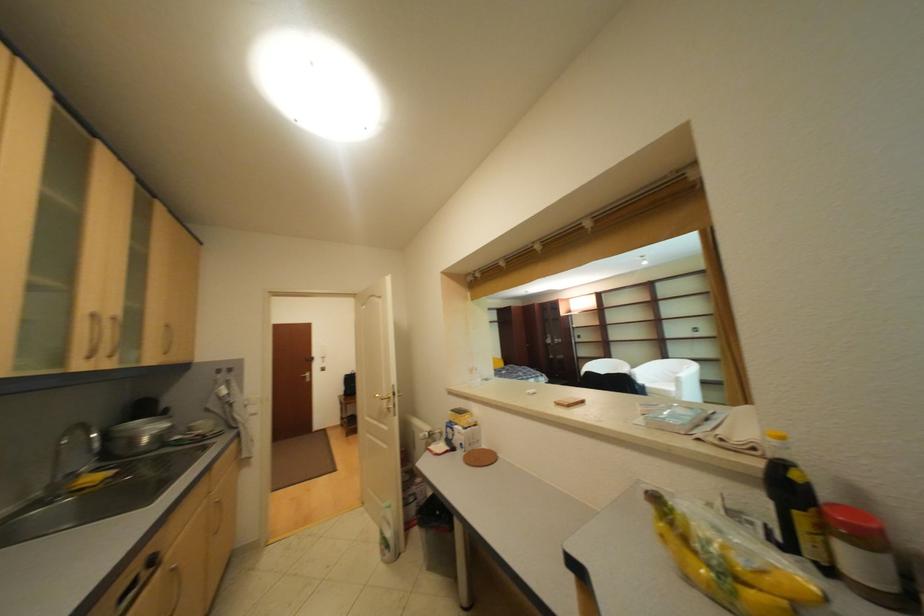
Describe the element at coordinates (391, 400) in the screenshot. I see `the white door handle` at that location.